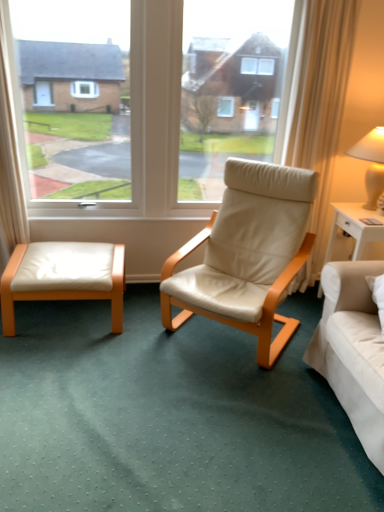
Locate an element on the screen. This screenshot has height=512, width=384. white glossy nightstand at right is located at coordinates (354, 227).

Where is `white leather ottoman at lower left`? This screenshot has height=512, width=384. white leather ottoman at lower left is located at coordinates point(64,276).

Is white leather ottoman at lower left smaller than white glossy nightstand at right?

Incorrect, white leather ottoman at lower left is not smaller in size than white glossy nightstand at right.

Could you tell me if white leather ottoman at lower left is turned towards white glossy nightstand at right?

No, white leather ottoman at lower left does not turn towards white glossy nightstand at right.

Based on the photo, is white leather ottoman at lower left not near white glossy nightstand at right?

white leather ottoman at lower left is far away from white glossy nightstand at right.

Find the location of `table lamp that appears above the white leather ottoman at lower left (from the image's perspective)`. table lamp that appears above the white leather ottoman at lower left (from the image's perspective) is located at coordinates (372, 164).

Could you tell me if white leather ottoman at lower left is facing matte beige lampshade at upper right?

No, white leather ottoman at lower left is not turned towards matte beige lampshade at upper right.

From the image's perspective, is white leather ottoman at lower left on top of matte beige lampshade at upper right?

No, from the image's perspective, white leather ottoman at lower left is not on top of matte beige lampshade at upper right.

Is matte beige lampshade at upper right completely or partially inside white leather ottoman at lower left?

No, matte beige lampshade at upper right is not inside white leather ottoman at lower left.

Considering the positions of objects white leather ottoman at lower left and beige leather chair at center in the image provided, who is more to the left, white leather ottoman at lower left or beige leather chair at center?

white leather ottoman at lower left.

What's the angular difference between white leather ottoman at lower left and beige leather chair at center's facing directions?

There is a 39.8-degree angle between the facing directions of white leather ottoman at lower left and beige leather chair at center.

Looking at this image, is white leather ottoman at lower left bigger or smaller than beige leather chair at center?

white leather ottoman at lower left is smaller than beige leather chair at center.

From a real-world perspective, between white leather ottoman at lower left and beige leather chair at center, who is vertically higher?

From a 3D spatial view, beige leather chair at center is above.

From a real-world perspective, who is located higher, matte beige lampshade at upper right or white glossy nightstand at right?

In real-world perspective, matte beige lampshade at upper right is above.

Can white glossy nightstand at right be found inside matte beige lampshade at upper right?

That's incorrect, white glossy nightstand at right is not inside matte beige lampshade at upper right.

Is beige leather chair at center not close to white leather ottoman at lower left?

They are positioned close to each other.

Considering the relative sizes of beige leather chair at center and white leather ottoman at lower left in the image provided, is beige leather chair at center wider than white leather ottoman at lower left?

Yes.

Does beige leather chair at center have a greater height compared to white leather ottoman at lower left?

Correct, beige leather chair at center is much taller as white leather ottoman at lower left.

Between beige leather chair at center and white leather ottoman at lower left, which one appears on the right side from the viewer's perspective?

beige leather chair at center.

Is matte beige lampshade at upper right thinner than white leather ottoman at lower left?

Yes, matte beige lampshade at upper right is thinner than white leather ottoman at lower left.

Is point (374, 197) closer to camera compared to point (116, 284)?

No.

From a real-world perspective, who is located lower, matte beige lampshade at upper right or white leather ottoman at lower left?

In real-world perspective, white leather ottoman at lower left is lower.

Is matte beige lampshade at upper right inside white glossy nightstand at right?

No, matte beige lampshade at upper right is not surrounded by white glossy nightstand at right.

From the image's perspective, between white glossy nightstand at right and matte beige lampshade at upper right, which one is located above?

matte beige lampshade at upper right appears higher in the image.

Are white glossy nightstand at right and matte beige lampshade at upper right far apart?

No.

Find the location of a particular element. The height and width of the screenshot is (512, 384). table below the white glossy nightstand at right (from a real-world perspective) is located at coordinates (64, 276).

Identify the location of table on the left of matte beige lampshade at upper right. The width and height of the screenshot is (384, 512). (64, 276).

Considering their positions, is white glossy nightstand at right positioned closer to white leather ottoman at lower left than beige leather chair at center?

Among the two, beige leather chair at center is located nearer to white leather ottoman at lower left.

Based on their spatial positions, is white glossy nightstand at right or white leather ottoman at lower left further from beige leather chair at center?

white leather ottoman at lower left lies further to beige leather chair at center than the other object.

Estimate the real-world distances between objects in this image. Which object is closer to white glossy nightstand at right, white leather ottoman at lower left or matte beige lampshade at upper right?

matte beige lampshade at upper right.

From the image, which object appears to be farther from white leather ottoman at lower left, beige leather chair at center or matte beige lampshade at upper right?

Among the two, matte beige lampshade at upper right is located further to white leather ottoman at lower left.

Based on their spatial positions, is matte beige lampshade at upper right or beige leather chair at center further from white leather ottoman at lower left?

The object further to white leather ottoman at lower left is matte beige lampshade at upper right.

Which object lies nearer to the anchor point white leather ottoman at lower left, matte beige lampshade at upper right or white glossy nightstand at right?

white glossy nightstand at right.

In the scene shown: When comparing their distances from matte beige lampshade at upper right, does white leather ottoman at lower left or white glossy nightstand at right seem closer?

white glossy nightstand at right.

Which object lies further to the anchor point beige leather chair at center, matte beige lampshade at upper right or white leather ottoman at lower left?

matte beige lampshade at upper right.

Locate an element on the screen. chair located between white leather ottoman at lower left and white glossy nightstand at right in the left-right direction is located at coordinates (247, 254).

Where is `chair between white leather ottoman at lower left and matte beige lampshade at upper right from left to right`? This screenshot has width=384, height=512. chair between white leather ottoman at lower left and matte beige lampshade at upper right from left to right is located at coordinates (247, 254).

Identify the location of nightstand between white leather ottoman at lower left and matte beige lampshade at upper right. The width and height of the screenshot is (384, 512). (354, 227).

Image resolution: width=384 pixels, height=512 pixels. In order to click on nightstand situated between beige leather chair at center and matte beige lampshade at upper right from left to right in this screenshot , I will do click(x=354, y=227).